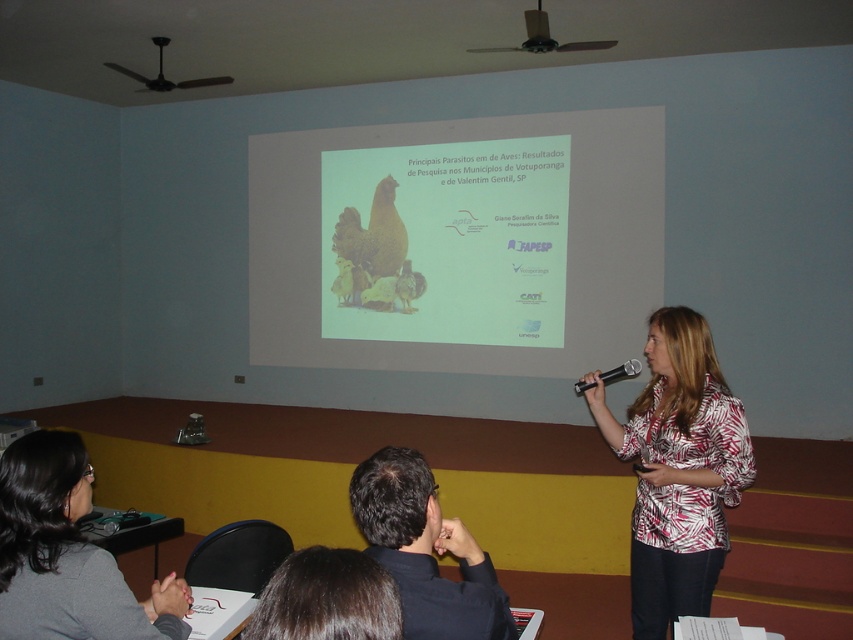
You are a photographer standing at the back of the room with a camera that has a maximum focus distance of 6 meters. You want to take a photo of the matte white screen at center. Can your camera focus on it?

The matte white screen at center is 6.15 meters away from the camera, which exceeds the maximum focus distance of 6 meters. Therefore, the camera cannot focus on the matte white screen at center.

You are an attendee at the presentation and need to locate the speaker who is wearing a white printed blouse at center. Where should you look in the room?

The speaker wearing the white printed blouse at center is located at point (x=677, y=468) in the room, so you should look towards that coordinate to find them.